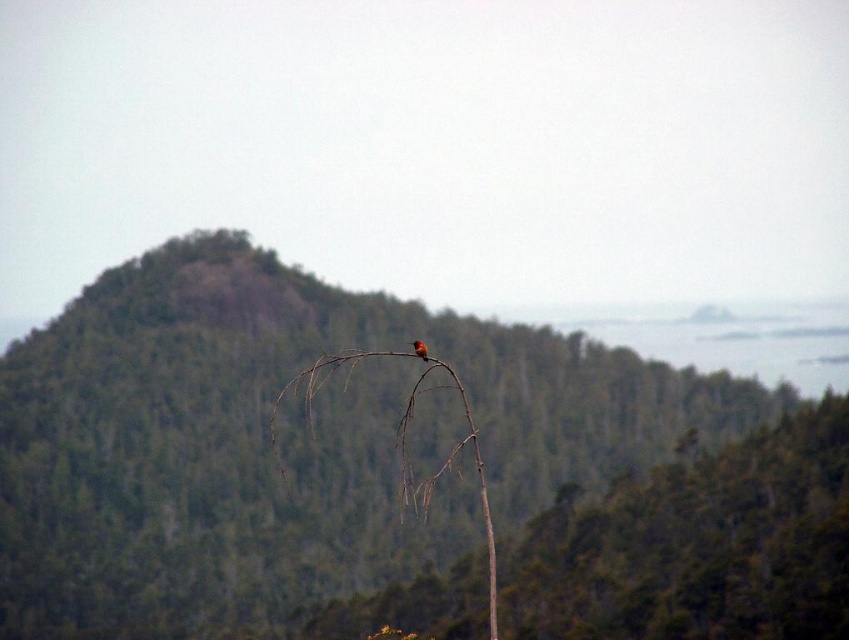
You are standing in the forest and see a point marked at coordinates (696, 545). What object does this point indicate?

The point at coordinates (696, 545) marks the brown wood tree at center.

You are standing at the origin point in the image. Which direction should you move to reach the green textured mountain at center?

The green textured mountain at center is located at coordinates 0.691 on the x axis and 0.339 on the y axis. To reach it from the origin, you should move towards the right and slightly upwards.

You are a hiker standing at the base of the green textured mountain at center and see the bright orange bird at center perched on a branch. Which object is taller?

The green textured mountain at center is taller than the bright orange bird at center.